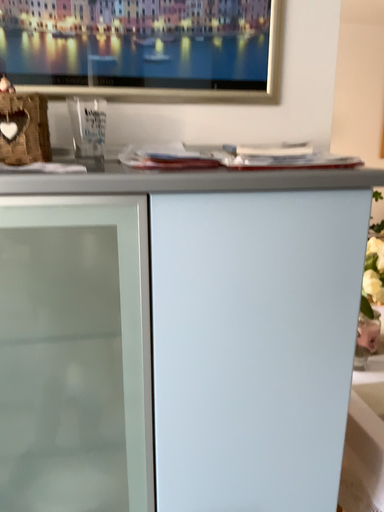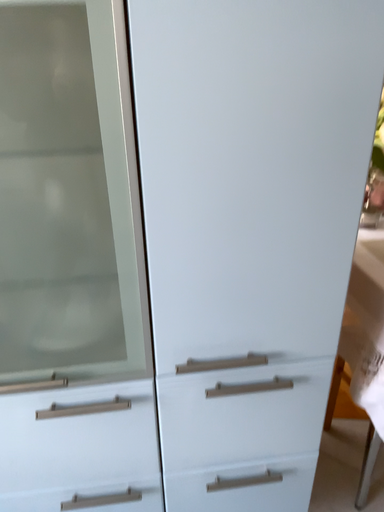
Question: Which way did the camera rotate in the video?

Choices:
 (A) rotated downward
 (B) rotated upward

Answer: (A)